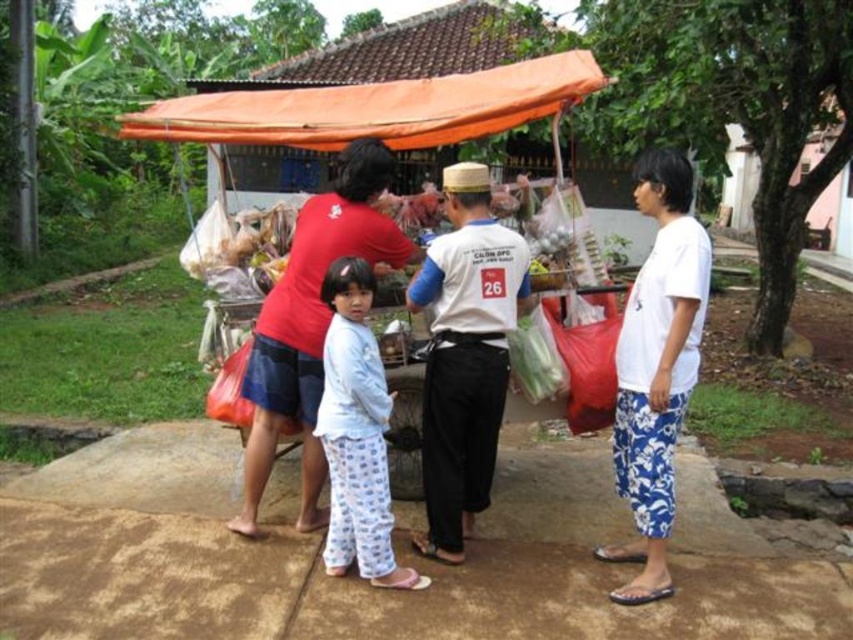
Question: Which point is farther to the camera?

Choices:
 (A) white cotton shirt at right
 (B) orange fabric canopy at upper center
 (C) matte red shirt at center
 (D) light blue pajama pants at center

Answer: (B)

Question: Can you confirm if white cotton shirt at right is positioned above white cotton pajamas at center?

Choices:
 (A) no
 (B) yes

Answer: (B)

Question: Can you confirm if white cotton shirt at center is positioned to the left of matte red shirt at center?

Choices:
 (A) yes
 (B) no

Answer: (B)

Question: Which point is farther from the camera taking this photo?

Choices:
 (A) (358, 435)
 (B) (409, 102)
 (C) (677, 326)

Answer: (B)

Question: Does orange fabric canopy at upper center have a lesser width compared to white cotton pajamas at center?

Choices:
 (A) no
 (B) yes

Answer: (A)

Question: Which of these objects is positioned closest to the white cotton shirt at center?

Choices:
 (A) matte red shirt at center
 (B) white cotton shirt at right
 (C) white cotton pajamas at center
 (D) light blue pajama pants at center

Answer: (C)